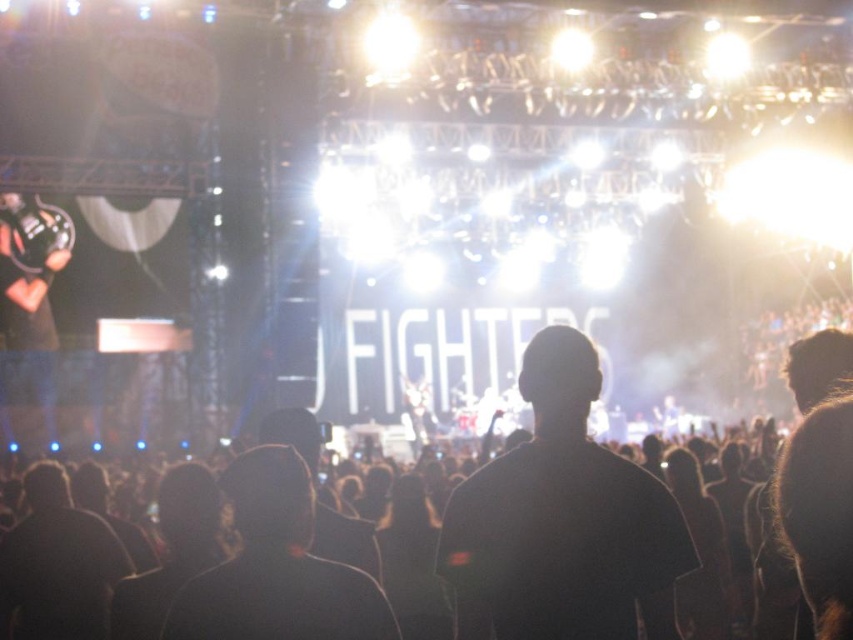
You are a photographer at the concert and want to capture a clear shot of the black matte headband at center and the black matte jacket at center. Since both are at the center, which one will appear larger in your photo?

The black matte headband at center is bigger than the black matte jacket at center, so it will appear larger in the photo.

You are a photographer at the concert and want to take a clear photo of the black matte headband at center. However, the black matte shirt at center is blocking your view. Can you adjust your position to capture the headband without the shirt obscuring it?

The black matte shirt at center is in front of the black matte headband at center, so adjusting your position might not help as the shirt is blocking the headband from the current viewpoint. You may need to move to a different angle where the shirt is no longer in front of the headband.

You are a photographer trying to capture a clear shot of both the black matte shirt at center and the black matte headband at center from the audience. Since both are at the center, which object should you focus on first to ensure it appears sharp in the photo?

The black matte shirt at center is bigger than the black matte headband at center, so you should focus on the black matte shirt at center first to ensure it appears sharp in the photo.